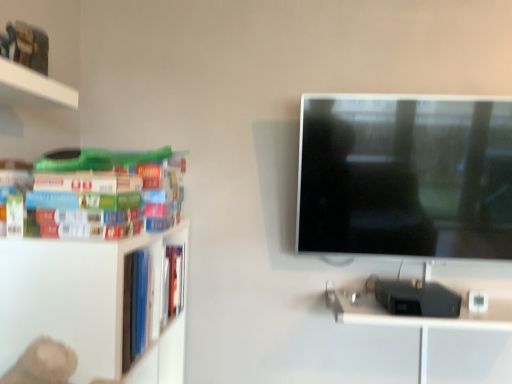
Question: From the image's perspective, is metallic silver computer desk at lower right positioned above or below hardcover books at left?

Choices:
 (A) below
 (B) above

Answer: (A)

Question: Would you say metallic silver computer desk at lower right is to the left or to the right of hardcover books at left in the picture?

Choices:
 (A) right
 (B) left

Answer: (A)

Question: Is metallic silver computer desk at lower right taller or shorter than hardcover books at left?

Choices:
 (A) short
 (B) tall

Answer: (A)

Question: In the image, is hardcover books at left on the left side or the right side of metallic silver computer desk at lower right?

Choices:
 (A) left
 (B) right

Answer: (A)

Question: Considering the positions of hardcover books at left and metallic silver computer desk at lower right in the image, is hardcover books at left wider or thinner than metallic silver computer desk at lower right?

Choices:
 (A) wide
 (B) thin

Answer: (B)

Question: Considering the positions of hardcover books at left and metallic silver computer desk at lower right in the image, is hardcover books at left bigger or smaller than metallic silver computer desk at lower right?

Choices:
 (A) small
 (B) big

Answer: (A)

Question: From their relative heights in the image, would you say hardcover books at left is taller or shorter than metallic silver computer desk at lower right?

Choices:
 (A) short
 (B) tall

Answer: (B)